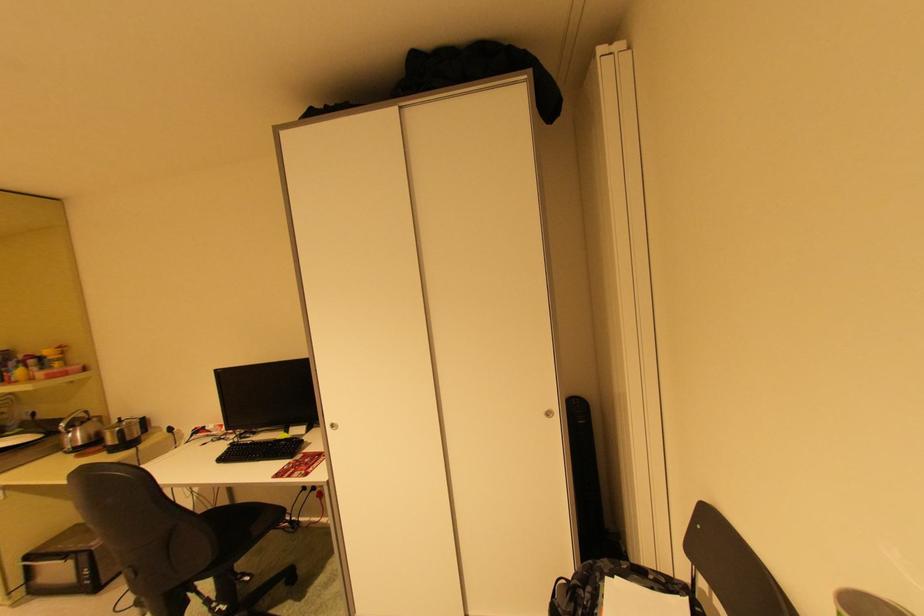
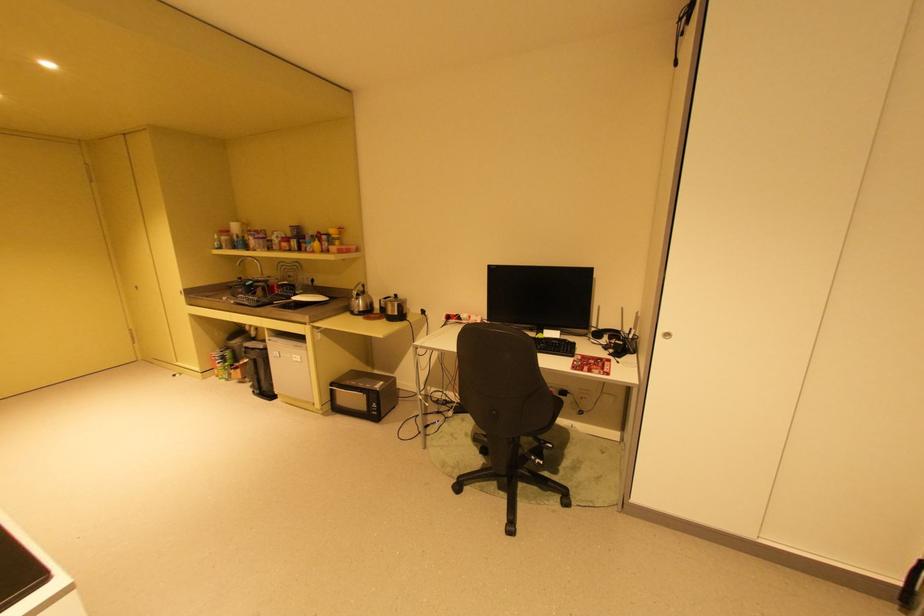
Question: Which direction would the cameraman need to move to produce the second image? Reply with the corresponding letter.

Choices:
 (A) Left
 (B) Right
 (C) Forward
 (D) Backward

Answer: (A)